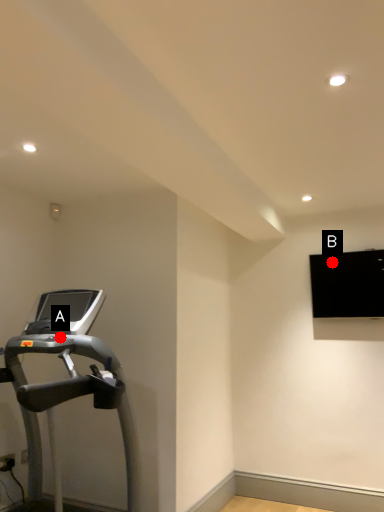
Question: Two points are circled on the image, labeled by A and B beside each circle. Which point is closer to the camera taking this photo?

Choices:
 (A) A is closer
 (B) B is closer

Answer: (A)